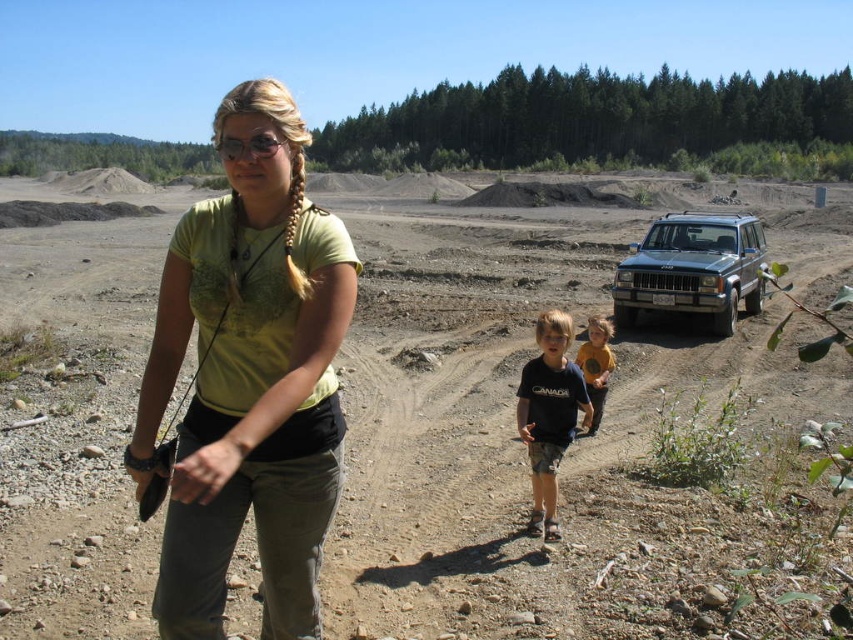
Does silver metallic suv at center right appear under dark blue t-shirt at center?

Incorrect, silver metallic suv at center right is not positioned below dark blue t-shirt at center.

Is point (682, 232) positioned in front of point (556, 346)?

That is False.

Who is more forward, (679,244) or (556,461)?

Point (556,461) is more forward.

Find the location of a particular element. silver metallic suv at center right is located at coordinates (693, 268).

Is point (639, 272) more distant than point (584, 356)?

Yes, point (639, 272) is farther from viewer.

Does point (695, 252) come in front of point (604, 324)?

That is False.

Identify the location of silver metallic suv at center right. (693, 268).

Between dirt field at center and yellow cotton shirt at center, which one is positioned lower?

yellow cotton shirt at center is below.

What are the coordinates of `dirt field at center` in the screenshot? It's located at (451, 397).

This screenshot has width=853, height=640. What are the coordinates of `dirt field at center` in the screenshot? It's located at (451, 397).